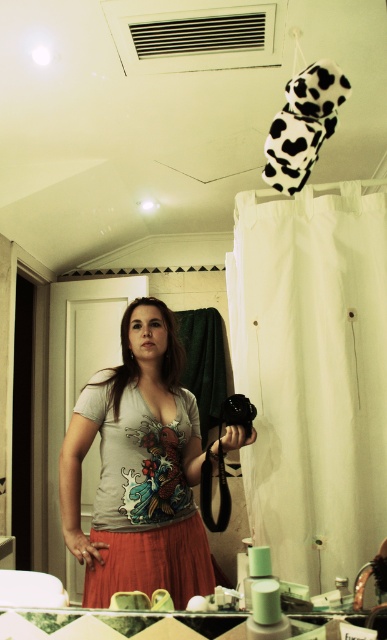
Question: Does matte cotton dress at center appear on the left side of black plastic camera at lower center?

Choices:
 (A) yes
 (B) no

Answer: (A)

Question: Considering the relative positions of matte cotton dress at center and black plastic camera at lower center in the image provided, where is matte cotton dress at center located with respect to black plastic camera at lower center?

Choices:
 (A) above
 (B) below

Answer: (B)

Question: Which point appears farthest from the camera in this image?

Choices:
 (A) (253, 416)
 (B) (172, 586)

Answer: (A)

Question: Which point is farther to the camera?

Choices:
 (A) black plastic camera at lower center
 (B) matte cotton dress at center

Answer: (A)

Question: Is matte cotton dress at center to the right of black plastic camera at lower center from the viewer's perspective?

Choices:
 (A) no
 (B) yes

Answer: (A)